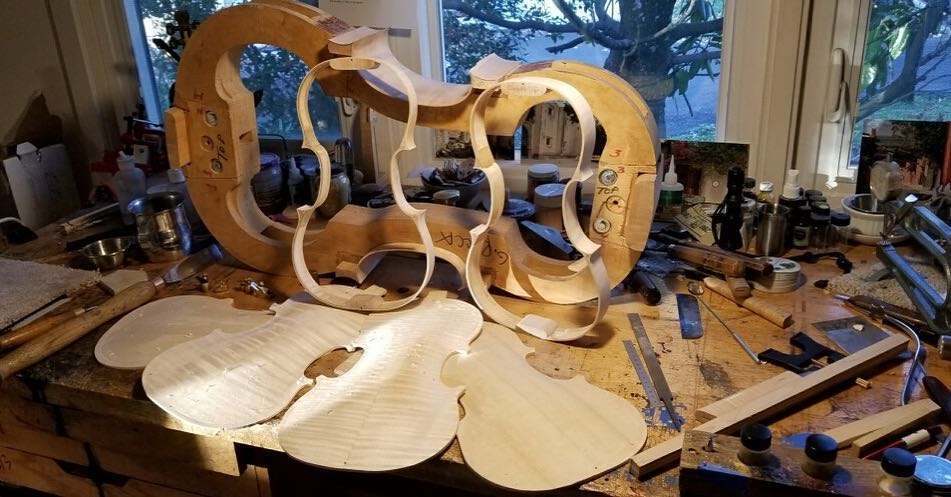
Find the location of a particular element. The height and width of the screenshot is (497, 951). windows is located at coordinates (697, 98), (460, 48), (154, 33), (288, 74), (881, 87).